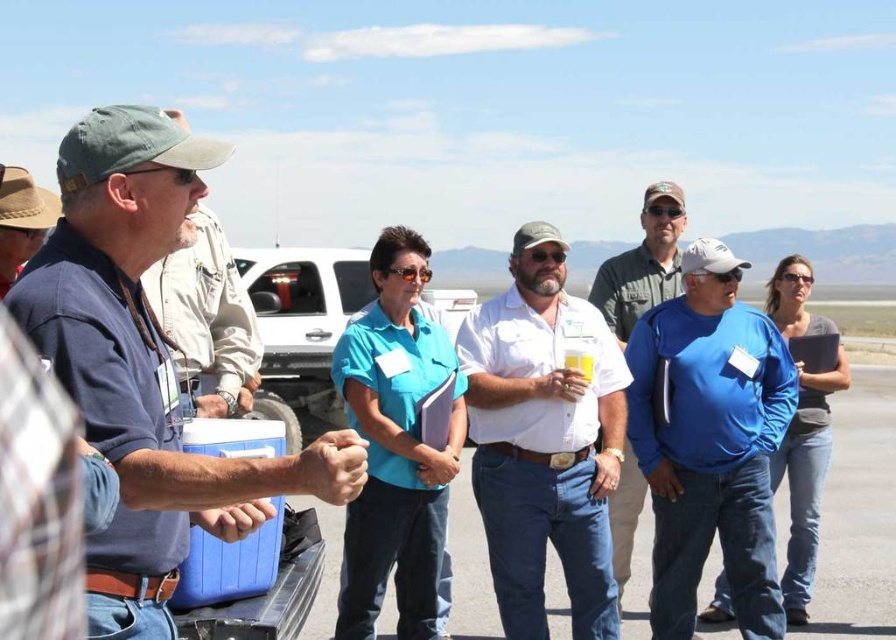
Question: Which object appears farthest from the camera in this image?

Choices:
 (A) denim jacket at left
 (B) white cotton shirt at center

Answer: (B)

Question: Is blue smooth shirt at center wider than white plastic cooler at center?

Choices:
 (A) yes
 (B) no

Answer: (B)

Question: Is blue smooth shirt at center further to camera compared to white plastic cooler at center?

Choices:
 (A) yes
 (B) no

Answer: (B)

Question: Can you confirm if blue smooth shirt at center is positioned to the left of green matte shirt at center?

Choices:
 (A) no
 (B) yes

Answer: (A)

Question: Which object is closer to the camera taking this photo?

Choices:
 (A) white plastic cooler at center
 (B) white cotton shirt at center

Answer: (B)

Question: Estimate the real-world distances between objects in this image. Which object is closer to the green matte shirt at center?

Choices:
 (A) yellow matte cup at center
 (B) matte blue shirt at center

Answer: (A)